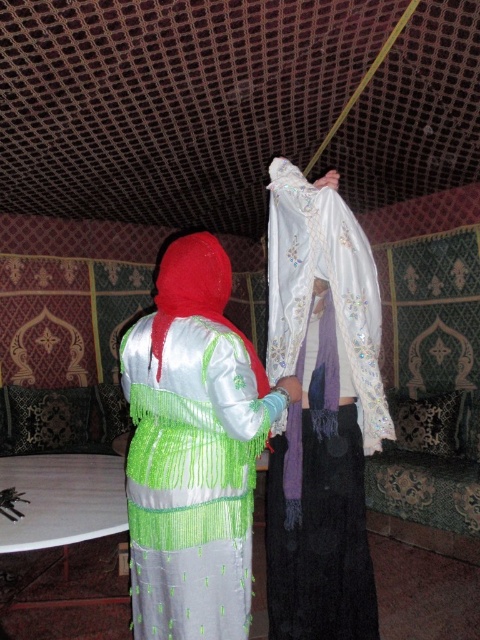
Question: Among these objects, which one is nearest to the camera?

Choices:
 (A) satin silk dress at center
 (B) white embroidered scarf at center

Answer: (A)

Question: Can you confirm if white embroidered scarf at center is smaller than satin silk dress at center?

Choices:
 (A) no
 (B) yes

Answer: (A)

Question: Does white embroidered scarf at center appear on the right side of satin silk dress at center?

Choices:
 (A) no
 (B) yes

Answer: (B)

Question: Does white embroidered scarf at center appear on the left side of satin silk dress at center?

Choices:
 (A) no
 (B) yes

Answer: (A)

Question: Among these objects, which one is farthest from the camera?

Choices:
 (A) white embroidered scarf at center
 (B) satin silk dress at center

Answer: (A)